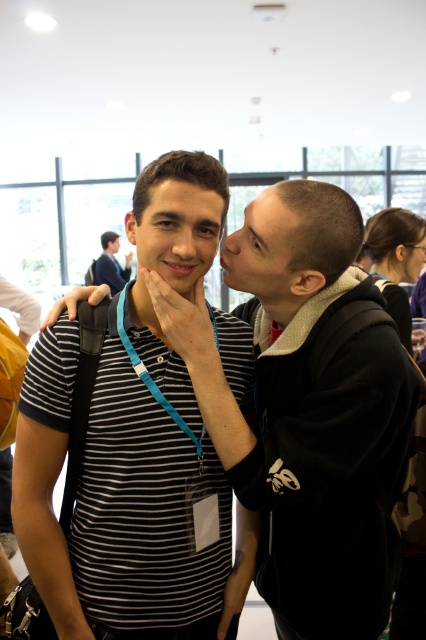
Question: Which object appears farthest from the camera in this image?

Choices:
 (A) blue fabric strap at center
 (B) striped cotton shirt at center

Answer: (A)

Question: Based on their relative distances, which object is nearer to the striped cotton shirt at center?

Choices:
 (A) blue fabric lanyard at center
 (B) matte black shirt at upper left

Answer: (A)

Question: Based on their relative distances, which object is farther from the striped cotton shirt at center?

Choices:
 (A) matte black shirt at upper left
 (B) blue fabric strap at center
 (C) blue fabric lanyard at center

Answer: (A)

Question: Observing the image, what is the correct spatial positioning of striped cotton shirt at center in reference to matte black shirt at upper left?

Choices:
 (A) right
 (B) left

Answer: (A)

Question: Can you confirm if blue fabric lanyard at center is bigger than matte black shirt at upper left?

Choices:
 (A) yes
 (B) no

Answer: (B)

Question: Is blue fabric strap at center below matte black shirt at upper left?

Choices:
 (A) no
 (B) yes

Answer: (B)